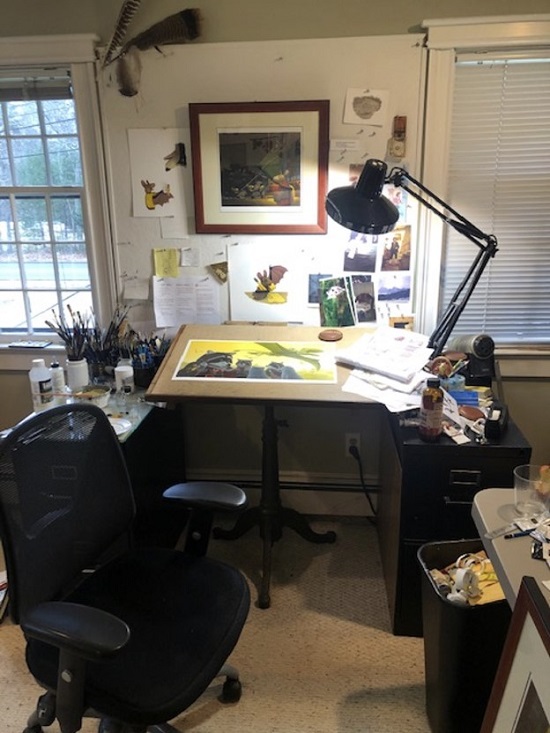
Locate an element on the screen. The height and width of the screenshot is (733, 550). plastic trash can, black is located at coordinates (463, 660).